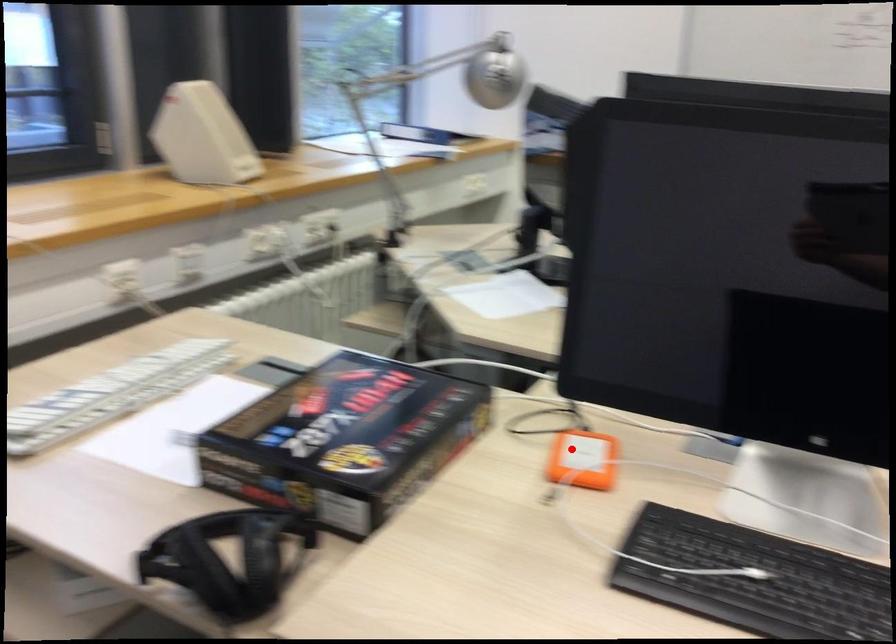
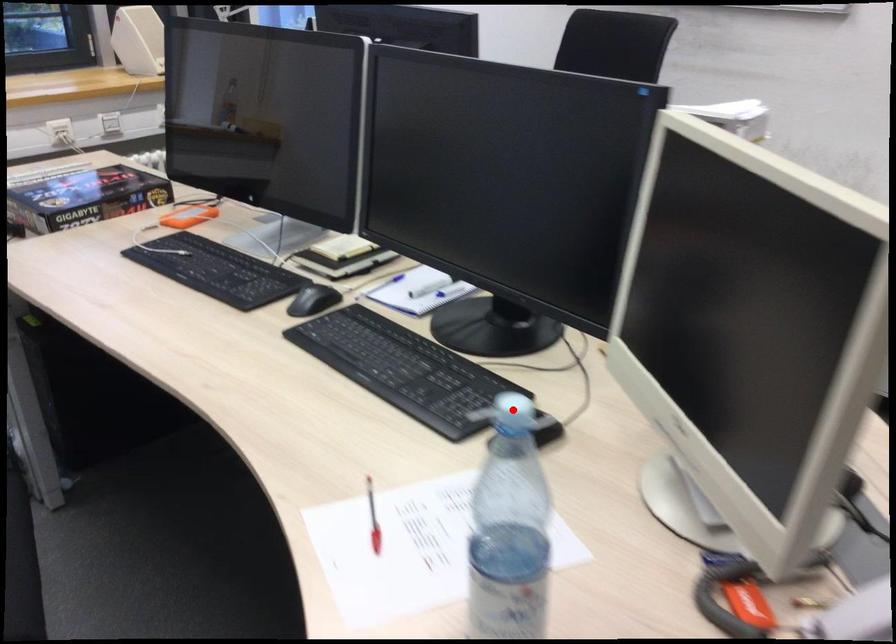
In the scene shown: I am providing you with two images of the same scene from different viewpoints. A red point is marked on the first image and another point is marked on the second image. Are the points marked in image1 and image2 representing the same 3D position?

No